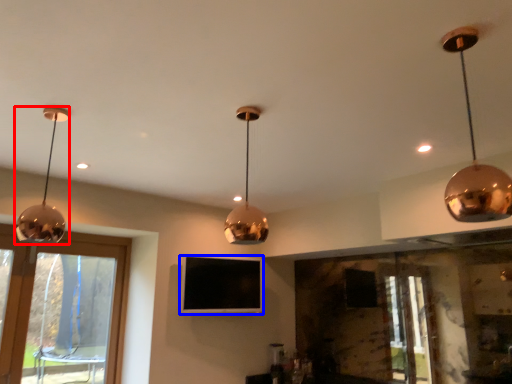
Question: Which of the following is the closest to the observer, lamp (highlighted by a red box) or television (highlighted by a blue box)?

Choices:
 (A) lamp
 (B) television

Answer: (A)